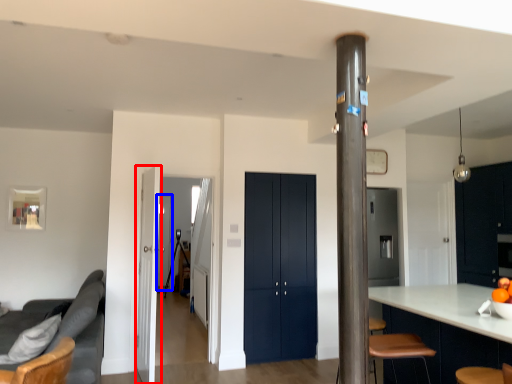
Question: Among these objects, which one is farthest to the camera, door (highlighted by a red box) or glass door (highlighted by a blue box)?

Choices:
 (A) door
 (B) glass door

Answer: (B)